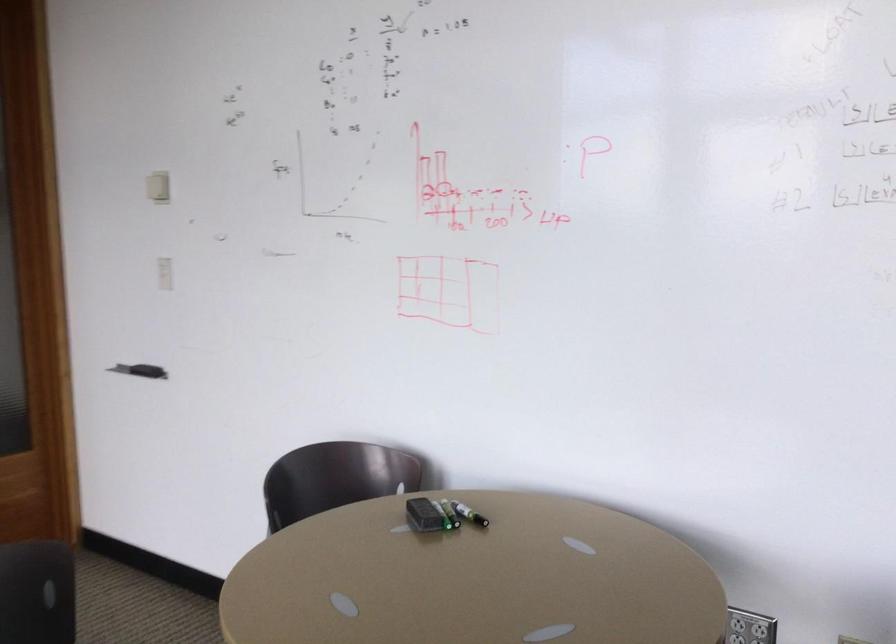
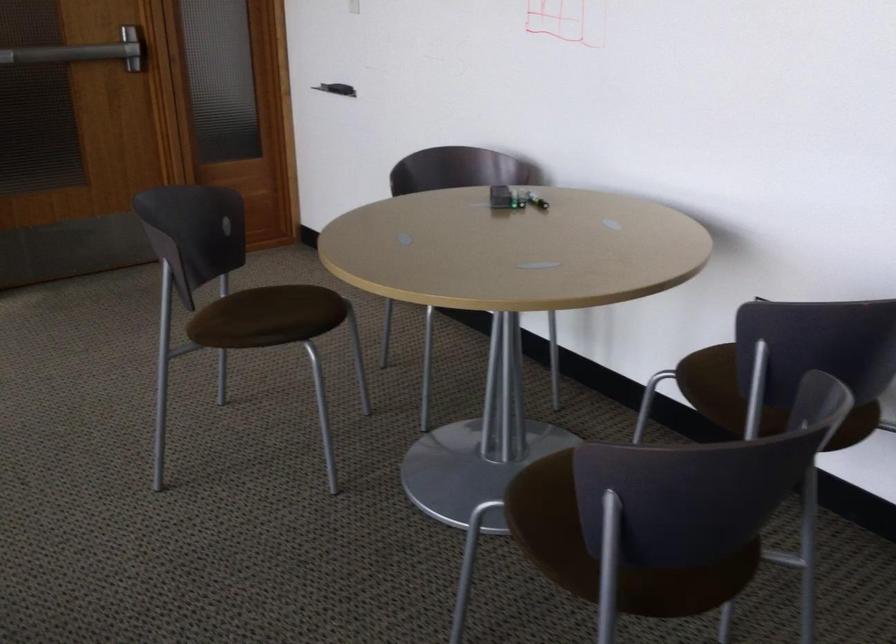
The images are taken continuously from a first-person perspective. In which direction are you moving?

The cameraman moved toward right, backward.